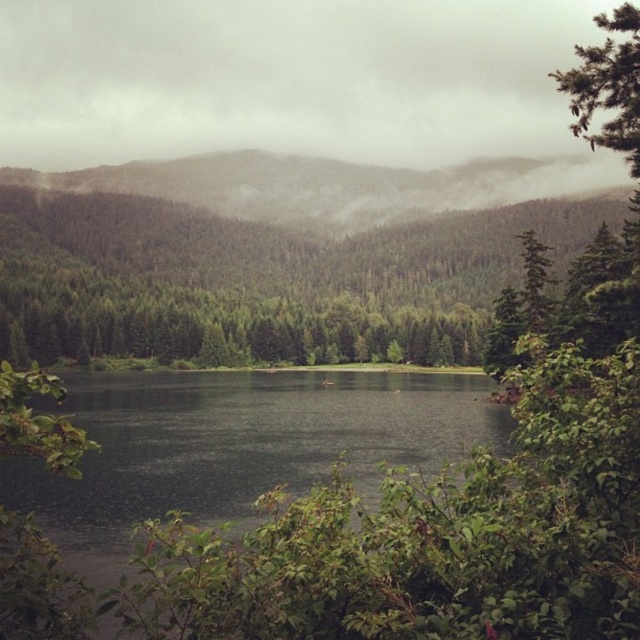
Question: Is green matte forest at center to the right of green forested mountain at upper center from the viewer's perspective?

Choices:
 (A) yes
 (B) no

Answer: (A)

Question: Which point appears closest to the camera in this image?

Choices:
 (A) coord(61,289)
 (B) coord(584,163)

Answer: (A)

Question: Which point is closer to the camera taking this photo?

Choices:
 (A) (472, 276)
 (B) (300, 163)

Answer: (A)

Question: Can you confirm if green matte forest at center is positioned to the right of green forested mountain at upper center?

Choices:
 (A) yes
 (B) no

Answer: (A)

Question: Does green matte forest at center appear over green forested mountain at upper center?

Choices:
 (A) no
 (B) yes

Answer: (A)